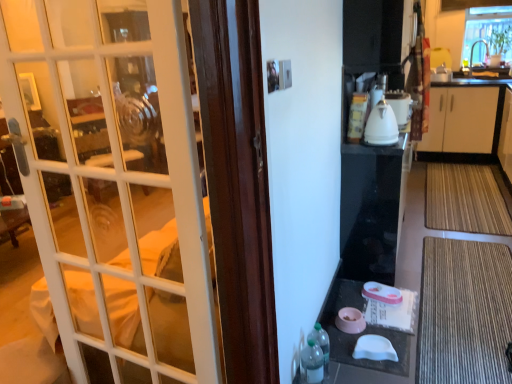
Question: Considering the relative positions of bamboo mat at lower right, placed as the 1th doormat when sorted from top to bottom, and pink plastic table at lower center in the image provided, is bamboo mat at lower right, placed as the 1th doormat when sorted from top to bottom, behind pink plastic table at lower center?

Choices:
 (A) yes
 (B) no

Answer: (A)

Question: Considering the relative sizes of bamboo mat at lower right, the 2th doormat in the front-to-back sequence, and pink plastic table at lower center in the image provided, is bamboo mat at lower right, the 2th doormat in the front-to-back sequence, shorter than pink plastic table at lower center?

Choices:
 (A) yes
 (B) no

Answer: (B)

Question: Can you confirm if bamboo mat at lower right, placed as the 1th doormat when sorted from top to bottom, is bigger than pink plastic table at lower center?

Choices:
 (A) no
 (B) yes

Answer: (B)

Question: Can you confirm if bamboo mat at lower right, marked as the first doormat in a back-to-front arrangement, is thinner than pink plastic table at lower center?

Choices:
 (A) yes
 (B) no

Answer: (B)

Question: Is bamboo mat at lower right, which appears as the second doormat when ordered from the bottom, not inside pink plastic table at lower center?

Choices:
 (A) yes
 (B) no

Answer: (A)

Question: From a real-world perspective, does bamboo mat at lower right, marked as the first doormat in a back-to-front arrangement, stand above pink plastic table at lower center?

Choices:
 (A) yes
 (B) no

Answer: (B)

Question: From the image's perspective, is brown textured mat at lower right, the second doormat positioned from the top, above clear glass window at upper right?

Choices:
 (A) no
 (B) yes

Answer: (A)

Question: Is brown textured mat at lower right, the second doormat positioned from the top, positioned beyond the bounds of clear glass window at upper right?

Choices:
 (A) yes
 (B) no

Answer: (A)

Question: Does brown textured mat at lower right, acting as the second doormat starting from the back, have a smaller size compared to clear glass window at upper right?

Choices:
 (A) no
 (B) yes

Answer: (B)

Question: Is brown textured mat at lower right, arranged as the first doormat when viewed from the front, directly adjacent to clear glass window at upper right?

Choices:
 (A) yes
 (B) no

Answer: (B)

Question: Is brown textured mat at lower right, arranged as the first doormat when viewed from the front, taller than clear glass window at upper right?

Choices:
 (A) no
 (B) yes

Answer: (A)

Question: Are brown textured mat at lower right, which ranks as the 1th doormat in bottom-to-top order, and clear glass window at upper right far apart?

Choices:
 (A) yes
 (B) no

Answer: (A)

Question: Can you confirm if white glass door at left is wider than clear glass window at upper right?

Choices:
 (A) yes
 (B) no

Answer: (B)